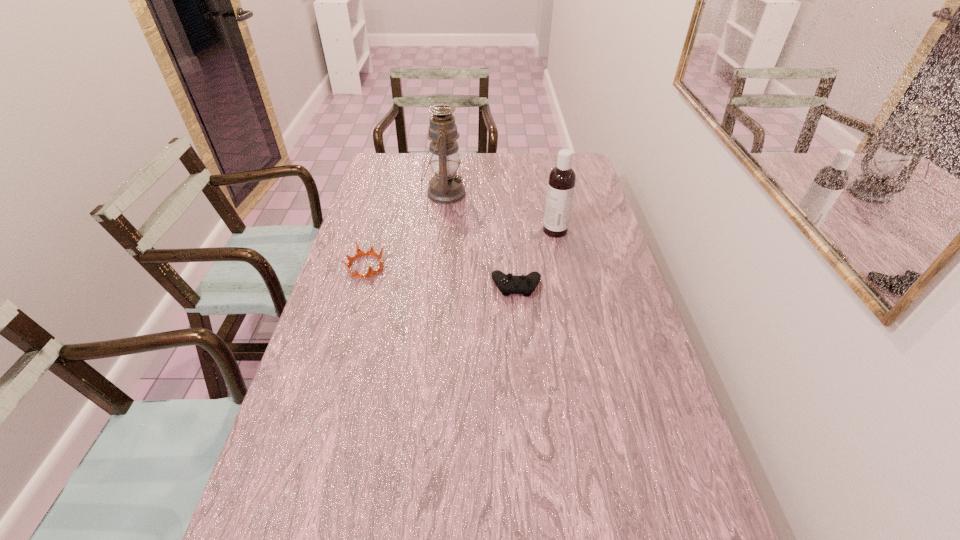
Image resolution: width=960 pixels, height=540 pixels. Identify the location of vacant space at the far left corner of the desktop. (380, 163).

Identify the location of free space that is in between the control and the dishwasher detergent. (536, 258).

At what (x,y) coordinates should I click in order to perform the action: click on free space between the third object from right to left and the leftmost object. Please return your answer as a coordinate pair (x, y). The width and height of the screenshot is (960, 540). Looking at the image, I should click on (405, 230).

Identify the location of unoccupied position between the third tallest object and the oil lamp. (405, 230).

In order to click on vacant area that lies between the oil lamp and the leftmost object in this screenshot , I will do `click(405, 230)`.

You are a GUI agent. You are given a task and a screenshot of the screen. Output one action in this format:
    pyautogui.click(x=<x>, y=<y>)
    Task: Click on the empty space that is in between the shortest object and the third tallest object
    
    Given the screenshot: What is the action you would take?
    coord(441,276)

The image size is (960, 540). I want to click on empty space between the leftmost object and the second farthest object, so click(x=461, y=248).

Locate an element on the screen. vacant area that lies between the control and the crown is located at coordinates (441, 276).

The height and width of the screenshot is (540, 960). In order to click on free space between the shortest object and the dishwasher detergent in this screenshot , I will do `click(536, 258)`.

The height and width of the screenshot is (540, 960). In order to click on vacant space that's between the second shortest object and the third shortest object in this screenshot , I will do `click(461, 248)`.